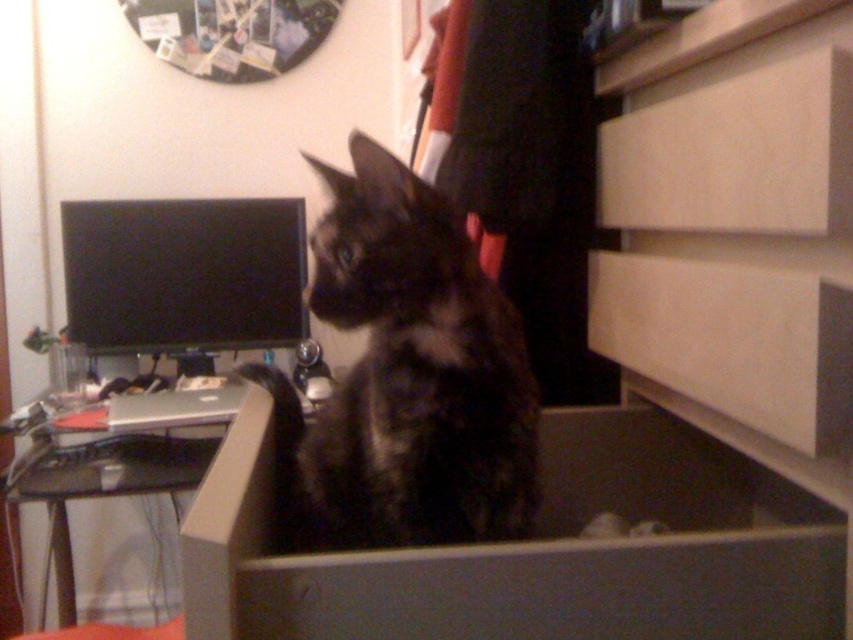
Question: Which of these objects is positioned farthest from the gray cardboard box at center?

Choices:
 (A) fluffy black cat at center
 (B) white matte drawer at center right
 (C) black plastic computer desk at lower left

Answer: (C)

Question: Can you confirm if white matte drawer at center right is positioned below black glossy monitor at upper left?

Choices:
 (A) yes
 (B) no

Answer: (A)

Question: Among these objects, which one is nearest to the camera?

Choices:
 (A) black plastic computer desk at lower left
 (B) black glossy monitor at upper left

Answer: (A)

Question: Where is gray cardboard box at center located in relation to black glossy monitor at upper left in the image?

Choices:
 (A) left
 (B) right

Answer: (B)

Question: Can you confirm if gray cardboard box at center is bigger than black plastic computer desk at lower left?

Choices:
 (A) yes
 (B) no

Answer: (A)

Question: Which object appears closest to the camera in this image?

Choices:
 (A) white matte drawer at center right
 (B) gray cardboard box at center

Answer: (B)